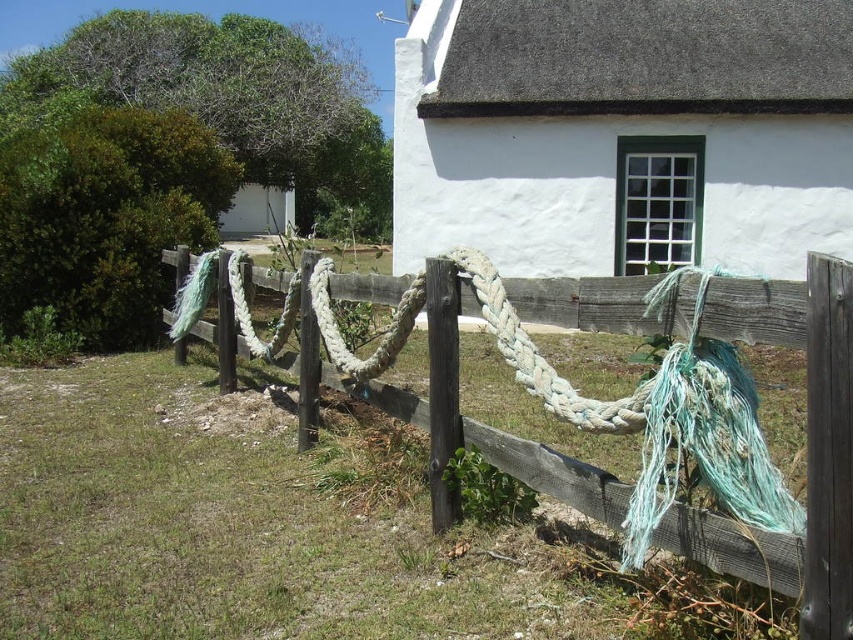
You are a painter standing at the center of the scene. You need to paint both the worn wood fence at center and the worn white rope at center. Which object should you paint first if you want to start with the taller one?

The worn wood fence at center has a greater height compared to the worn white rope at center, so you should paint the worn wood fence at center first.